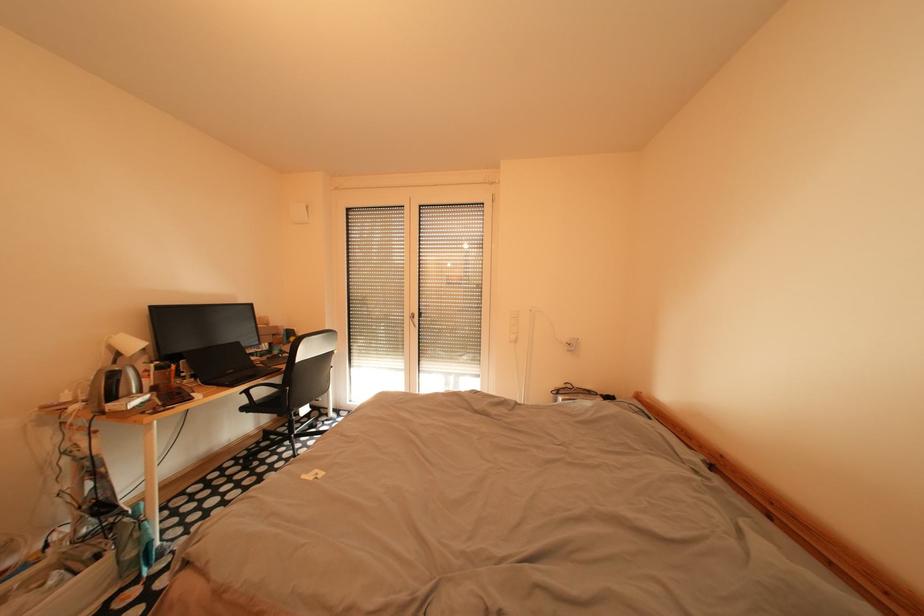
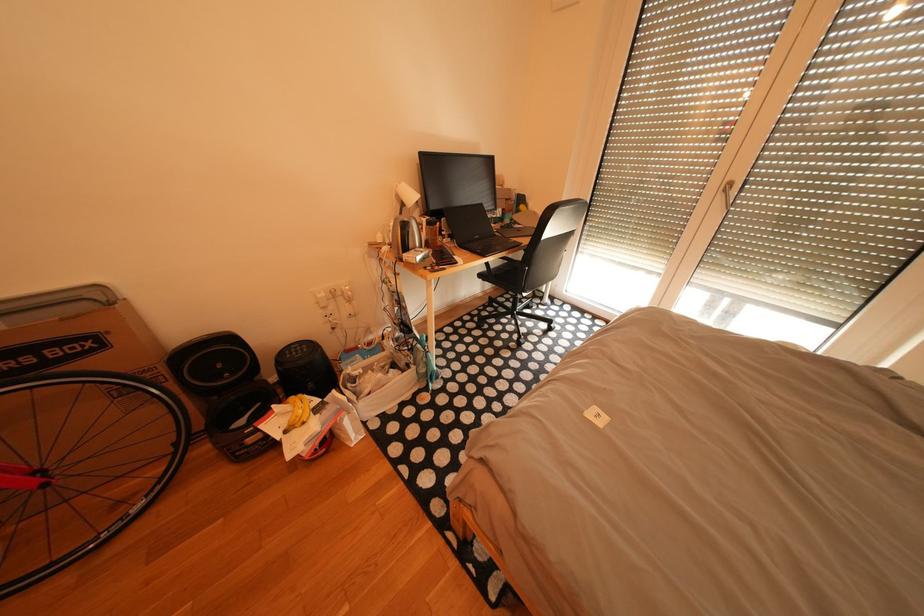
Based on the continuous images, in which direction is the camera rotating?

The camera's rotation is toward left-down.